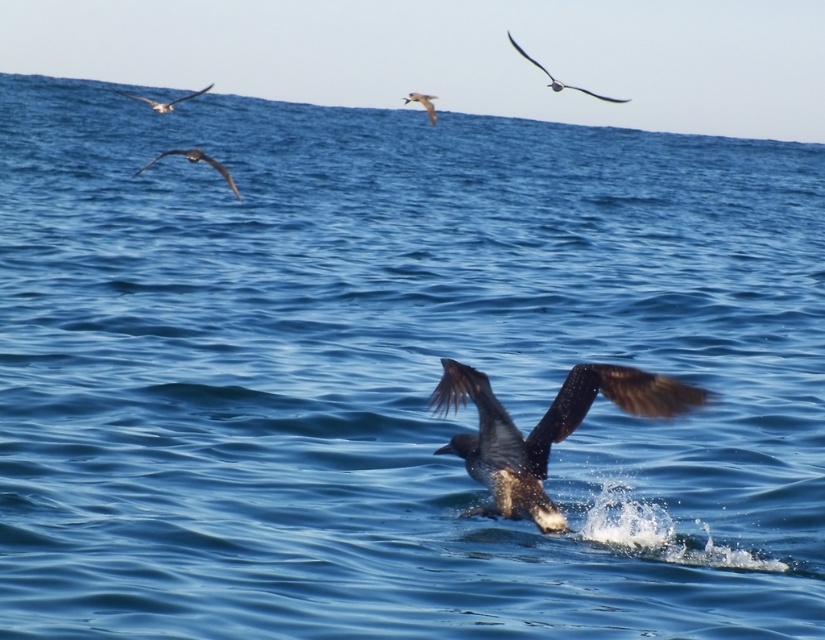
Question: Is brown feathered bird at center positioned behind white glossy seagull at upper center?

Choices:
 (A) no
 (B) yes

Answer: (A)

Question: Which point is farther to the camera?

Choices:
 (A) brown feathered bird at center
 (B) dark brown feathers at upper left

Answer: (B)

Question: Can you confirm if dark brown feathers at upper right is positioned to the right of shiny silver bird at upper left?

Choices:
 (A) yes
 (B) no

Answer: (A)

Question: Which is nearer to the dark brown feathers at upper left?

Choices:
 (A) brown feathered bird at center
 (B) shiny silver bird at upper left

Answer: (B)

Question: Is brown feathered bird at center smaller than dark brown feathers at upper left?

Choices:
 (A) yes
 (B) no

Answer: (A)

Question: Which point is closer to the camera taking this photo?

Choices:
 (A) (583, 387)
 (B) (409, 97)

Answer: (A)